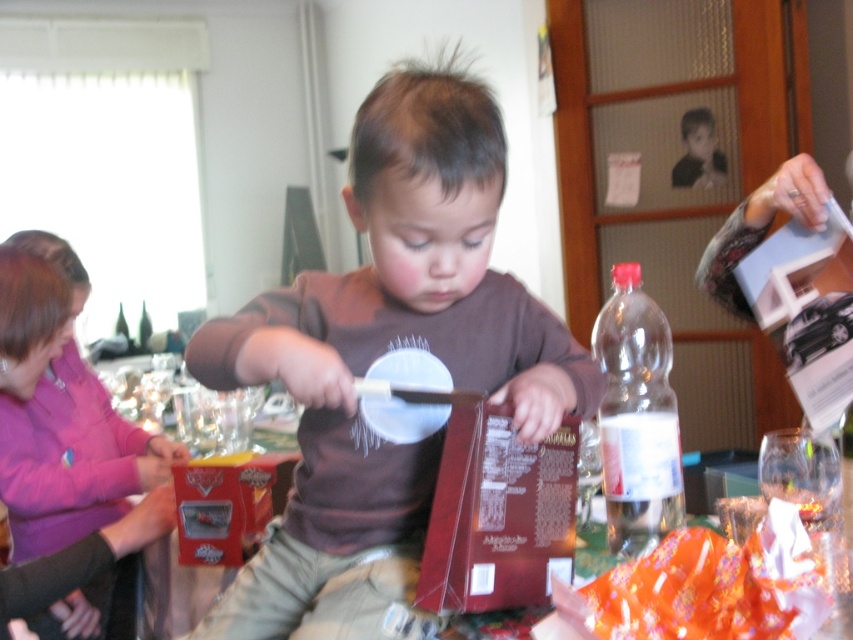
Based on the photo, where is the brown matte shirt at center located in the image?

The brown matte shirt at center is located at point 0.555 on the x axis and 0.450 on the y axis.

You are a guest at the gathering and want to place a small gift on the table without covering the transparent plastic bottle at center. Where should you place the gift in relation to the brown matte shirt at center?

Since the brown matte shirt at center is taller than the transparent plastic bottle at center, placing the gift near the base of the brown matte shirt at center would ensure it doesn not cover the bottle.

You are a guest at this family gathering and need to grab a drink quickly. The clear plastic bottle at right and transparent plastic bottle at left are both on the table. Which one is closer to you?

The clear plastic bottle at right and transparent plastic bottle at left are 3.48 meters apart, so you need to determine which one is closer based on their positions. However, the description only provides the distance between them, not their individual distances from you. Without additional information about their placement relative to your position, it is impossible to determine which is closer.